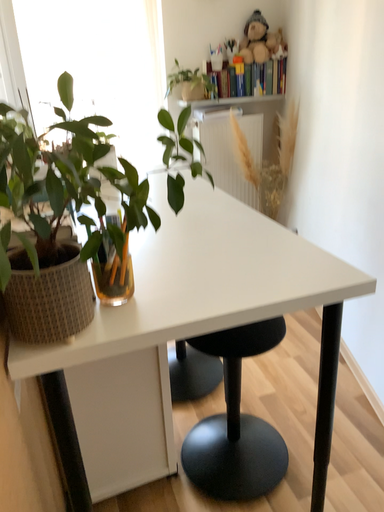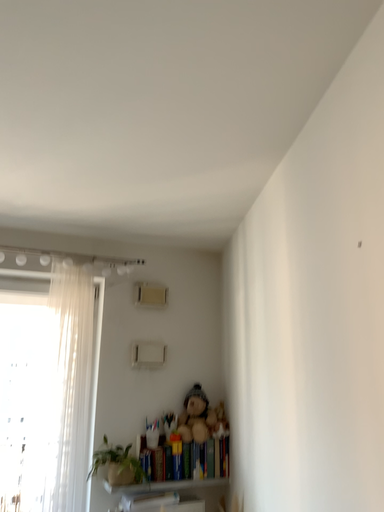
Question: Which way did the camera rotate in the video?

Choices:
 (A) rotated downward
 (B) rotated upward

Answer: (B)